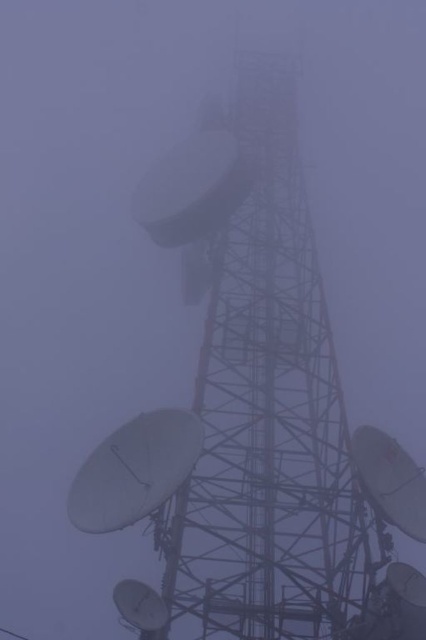
Question: Which point is closer to the camera?

Choices:
 (A) pos(287,266)
 (B) pos(129,500)

Answer: (B)

Question: Does metallic gray satellite dish at center appear on the left side of white matte satellite at center?

Choices:
 (A) no
 (B) yes

Answer: (A)

Question: Considering the relative positions of metallic gray satellite dish at center and white matte satellite at center in the image provided, where is metallic gray satellite dish at center located with respect to white matte satellite at center?

Choices:
 (A) above
 (B) below

Answer: (A)

Question: Can you confirm if metallic gray satellite dish at center is thinner than white matte satellite at center?

Choices:
 (A) no
 (B) yes

Answer: (A)